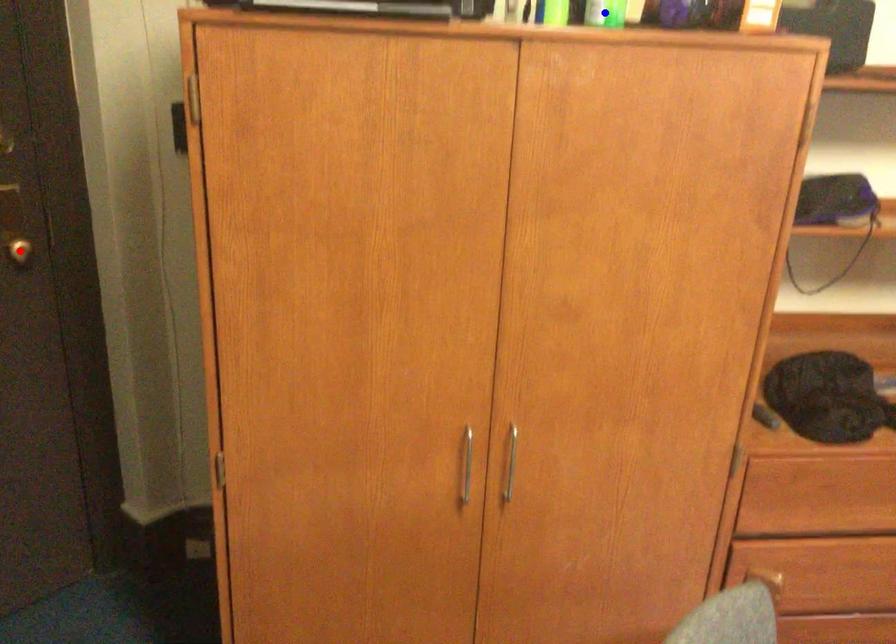
Question: Two points are marked on the image. Which point is closer to the camera?

Choices:
 (A) Blue point is closer.
 (B) Red point is closer.

Answer: (A)